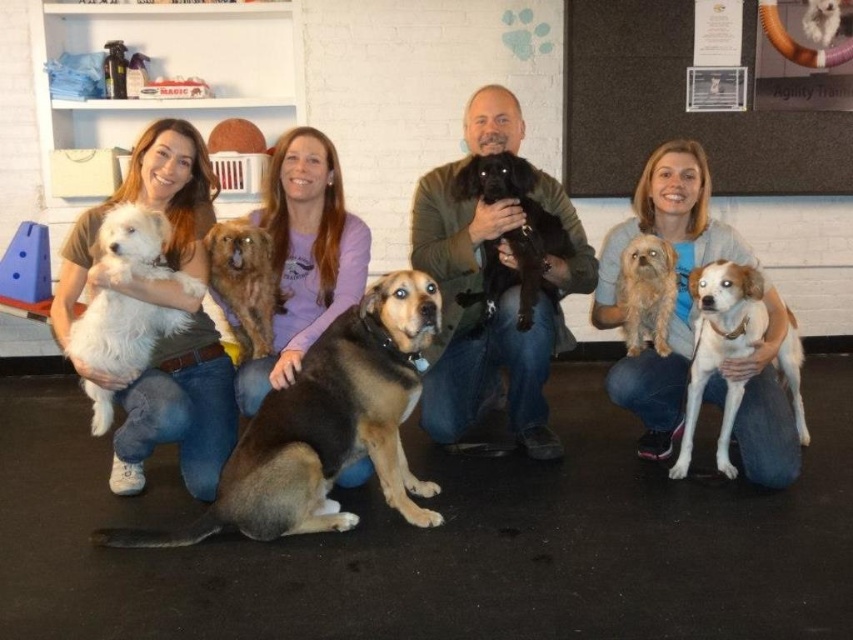
Is light blue shirt at center below white fluffy dog at left?

No.

How distant is light blue shirt at center from white fluffy dog at left?

1.66 meters

You are a GUI agent. You are given a task and a screenshot of the screen. Output one action in this format:
    pyautogui.click(x=<x>, y=<y>)
    Task: Click on the light blue shirt at center
    This screenshot has width=853, height=640.
    Given the screenshot: What is the action you would take?
    pyautogui.click(x=677, y=285)

What do you see at coordinates (718, 333) in the screenshot? The height and width of the screenshot is (640, 853). I see `white fur dog at lower right` at bounding box center [718, 333].

This screenshot has height=640, width=853. What do you see at coordinates (718, 333) in the screenshot?
I see `white fur dog at lower right` at bounding box center [718, 333].

You are a GUI agent. You are given a task and a screenshot of the screen. Output one action in this format:
    pyautogui.click(x=<x>, y=<y>)
    Task: Click on the white fur dog at lower right
    This screenshot has width=853, height=640.
    Given the screenshot: What is the action you would take?
    pyautogui.click(x=718, y=333)

Is brown fur dog at center above white fur dog at left?

Actually, brown fur dog at center is below white fur dog at left.

Between point (294, 445) and point (149, 298), which one is positioned in front?

Point (294, 445) is more forward.

You are a GUI agent. You are given a task and a screenshot of the screen. Output one action in this format:
    pyautogui.click(x=<x>, y=<y>)
    Task: Click on the brown fur dog at center
    This screenshot has height=640, width=853.
    Given the screenshot: What is the action you would take?
    pyautogui.click(x=325, y=426)